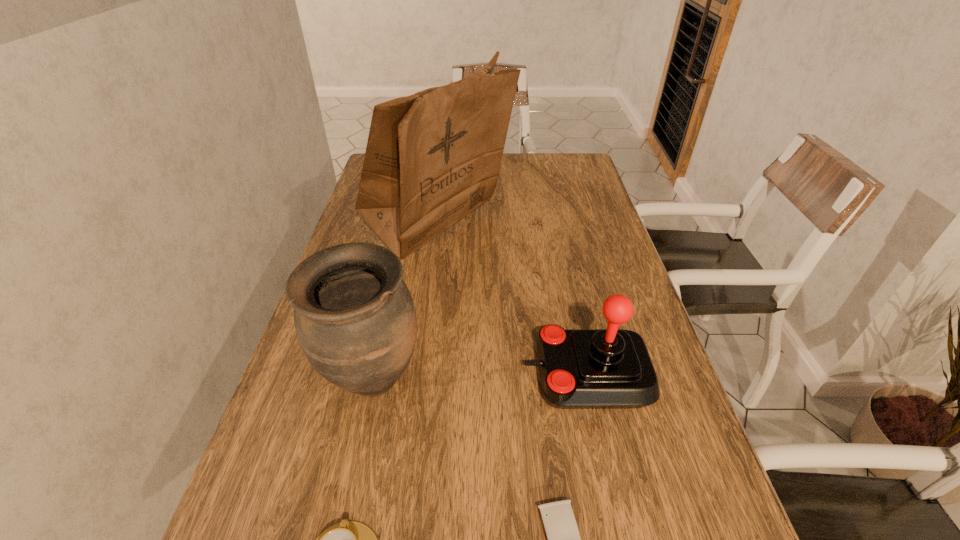
Locate an element on the screen. This screenshot has width=960, height=540. the tallest object is located at coordinates (433, 157).

Find the location of `the farthest object`. the farthest object is located at coordinates (433, 157).

What are the coordinates of `urn` in the screenshot? It's located at (355, 320).

Locate an element on the screen. The width and height of the screenshot is (960, 540). joystick is located at coordinates (611, 368).

This screenshot has height=540, width=960. I want to click on free space located 0.330m on the front of the tallest object, so click(415, 400).

This screenshot has width=960, height=540. I want to click on free space located 0.360m on the right of the urn, so pyautogui.click(x=602, y=381).

Locate an element on the screen. This screenshot has height=540, width=960. free space located on the base of the third tallest object is located at coordinates coord(500,375).

Identify the location of blank area located 0.300m on the base of the third tallest object. Image resolution: width=960 pixels, height=540 pixels. (378, 375).

Find the location of a particular element. free space located 0.120m on the base of the third tallest object is located at coordinates (466, 375).

The image size is (960, 540). I want to click on grocery bag that is at the left edge, so (x=433, y=157).